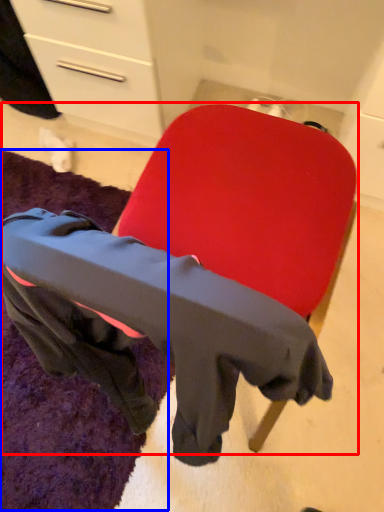
Question: Which of the following is the farthest to the observer, chair (highlighted by a red box) or mat (highlighted by a blue box)?

Choices:
 (A) chair
 (B) mat

Answer: (B)